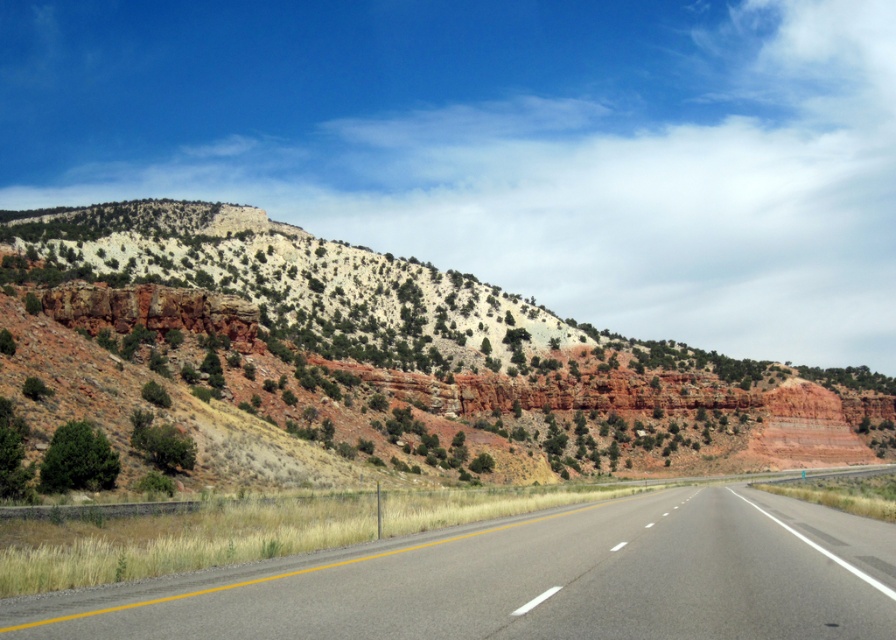
Based on the photo, you are driving a car that is 15 feet long. You want to stop your car so that it is exactly halfway between the rustic rock formation at center and yourself. Is this possible?

The distance between rustic rock formation at center and the viewer is 149.67 feet. Half of that distance is approximately 74.83 feet. Since the car is 15 feet long, you can position the car so that its front is at 74.83 feet from the viewer, allowing the entire car to fit within the halfway point without exceeding the distance to the rustic rock formation at center.

In the scene shown: You are a drone operator planning to fly a drone along the highway. You have two points marked on your map, point (118,282) and point (635,548). If you want to fly the drone from the closer point to the farther point, which point should you start at?

You should start at point (118,282) because it is closer to the viewer than point (635,548).